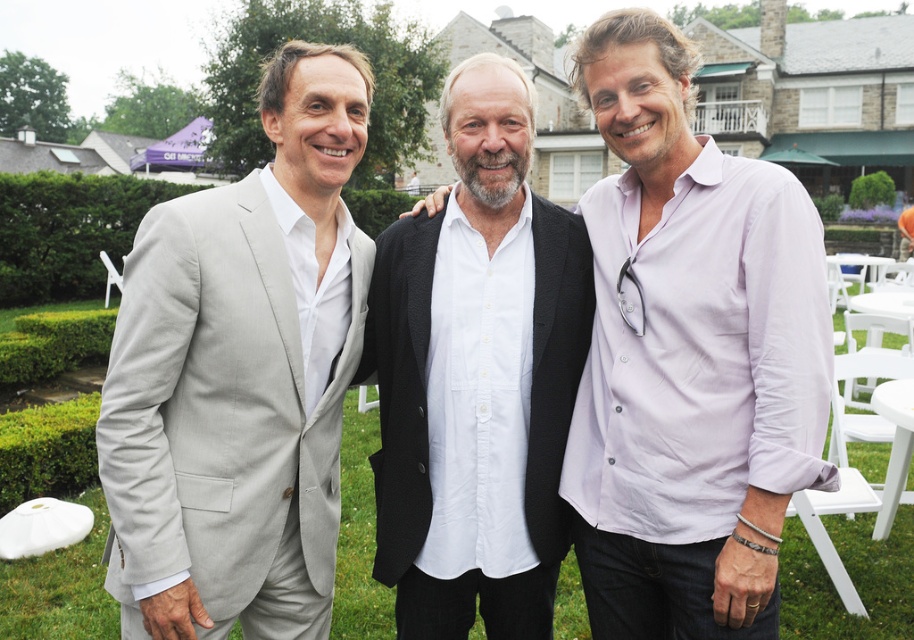
Question: Can you confirm if light gray suit at left is positioned to the left of green leafy hedge at left?

Choices:
 (A) no
 (B) yes

Answer: (A)

Question: Which of the following is the closest to the observer?

Choices:
 (A) (188, 186)
 (B) (829, 348)
 (C) (505, 317)

Answer: (B)

Question: Does light gray suit at left lie in front of green leafy hedge at left?

Choices:
 (A) no
 (B) yes

Answer: (B)

Question: Can you confirm if matte white shirt at center is bigger than green leafy hedge at left?

Choices:
 (A) no
 (B) yes

Answer: (A)

Question: Which point is farther from the camera taking this photo?

Choices:
 (A) (101, 262)
 (B) (486, 538)
 (C) (635, 483)
 (D) (278, 248)

Answer: (A)

Question: Which object is positioned farthest from the white cotton shirt at center?

Choices:
 (A) green leafy hedge at left
 (B) light gray suit at left
 (C) matte white shirt at center

Answer: (A)